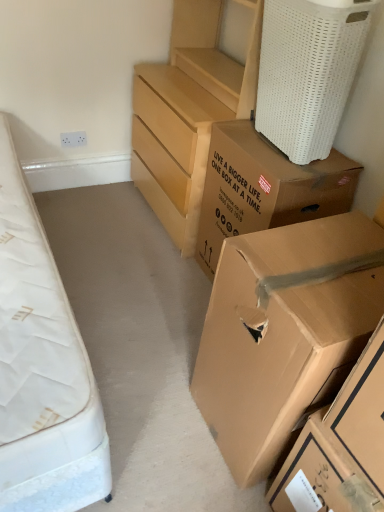
The height and width of the screenshot is (512, 384). What are the coordinates of `vacant space underneath white woven laundry basket at upper right (from a real-world perspective)` in the screenshot? It's located at (276, 154).